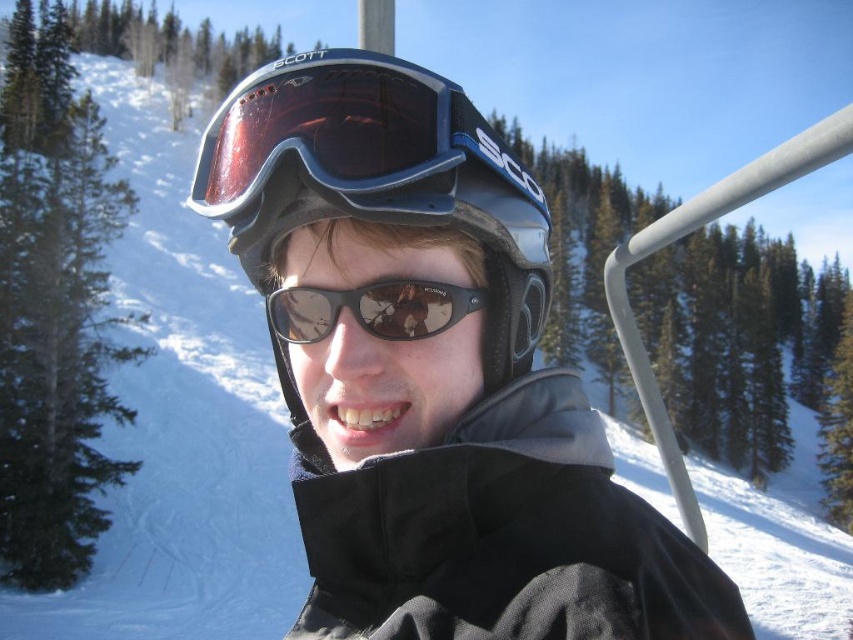
You are a ski instructor checking the equipment of a student. The student has both matte blue goggles at center and black reflective sunglasses at center. Which piece of eyewear is positioned higher on their face?

The matte blue goggles at center is located above the black reflective sunglasses at center, so the goggles are positioned higher on the student.

Looking at this image, you are a photographer trying to capture a closeup of the person on the ski lift. You notice the matte black helmet at center and the matte blue goggles at center. Which object should you focus on first if you want to ensure both are in focus, considering their sizes?

The matte black helmet at center is larger in size than the matte blue goggles at center, so focusing on the matte black helmet at center first would better ensure both are in focus due to its larger size.